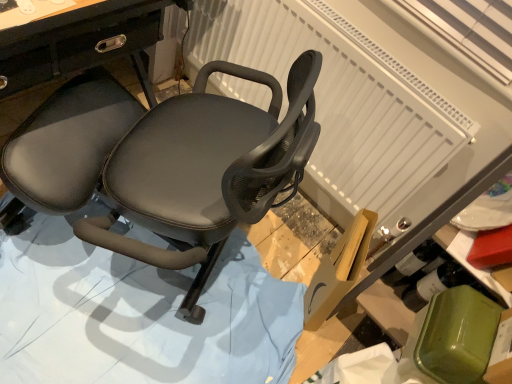
Question: Does point (129, 203) appear closer or farther from the camera than point (424, 87)?

Choices:
 (A) farther
 (B) closer

Answer: (B)

Question: From the image's perspective, is matte black chair at center located above or below white textured radiator at upper center?

Choices:
 (A) above
 (B) below

Answer: (B)

Question: Based on their relative distances, which object is farther from the black leather chair at center?

Choices:
 (A) matte black chair at center
 (B) white textured radiator at upper center

Answer: (B)

Question: Estimate the real-world distances between objects in this image. Which object is closer to the black leather chair at center?

Choices:
 (A) white textured radiator at upper center
 (B) matte black chair at center

Answer: (B)